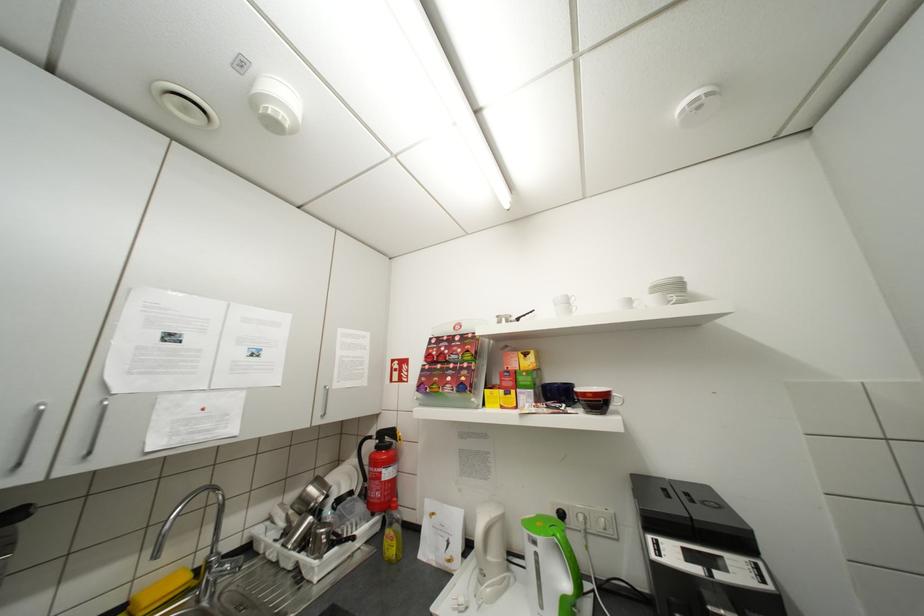
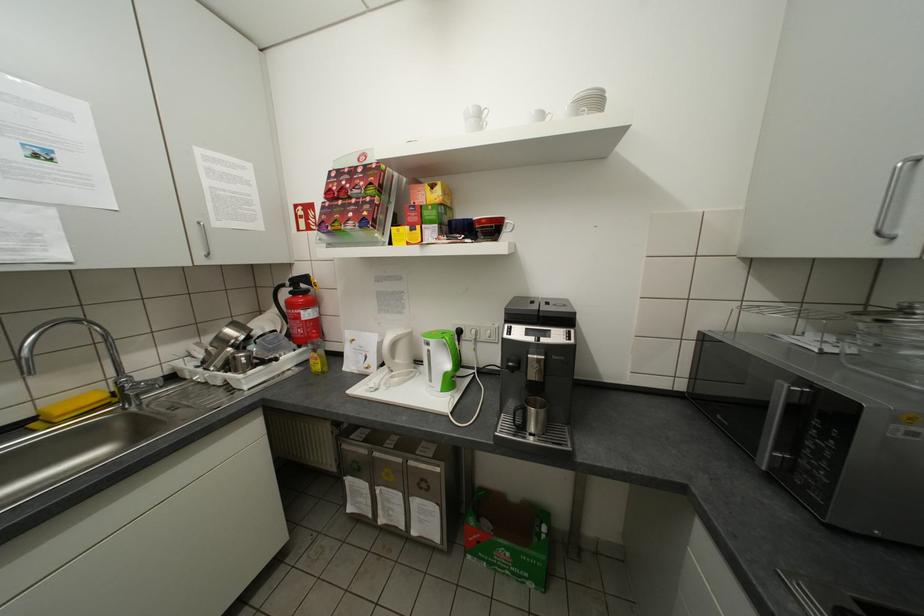
In the second image, find the point that corresponds to (215,562) in the first image.

(126, 383)